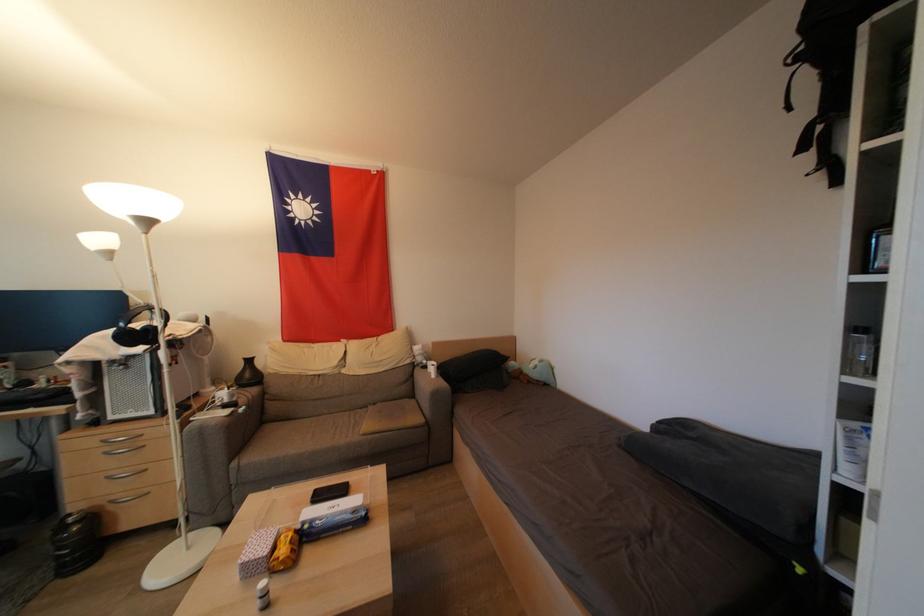
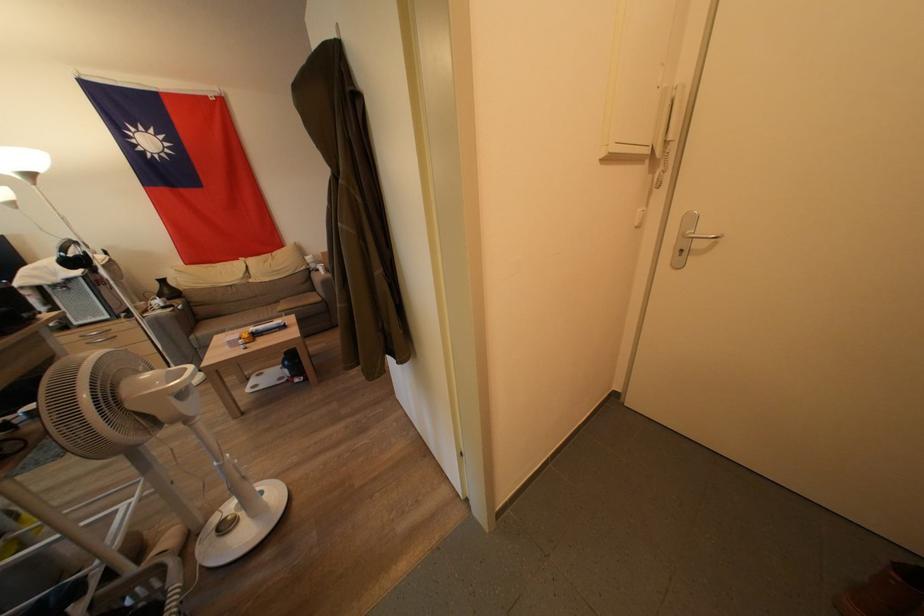
Find the pixel in the second image that matches pixel 155 313 in the first image.

(79, 246)